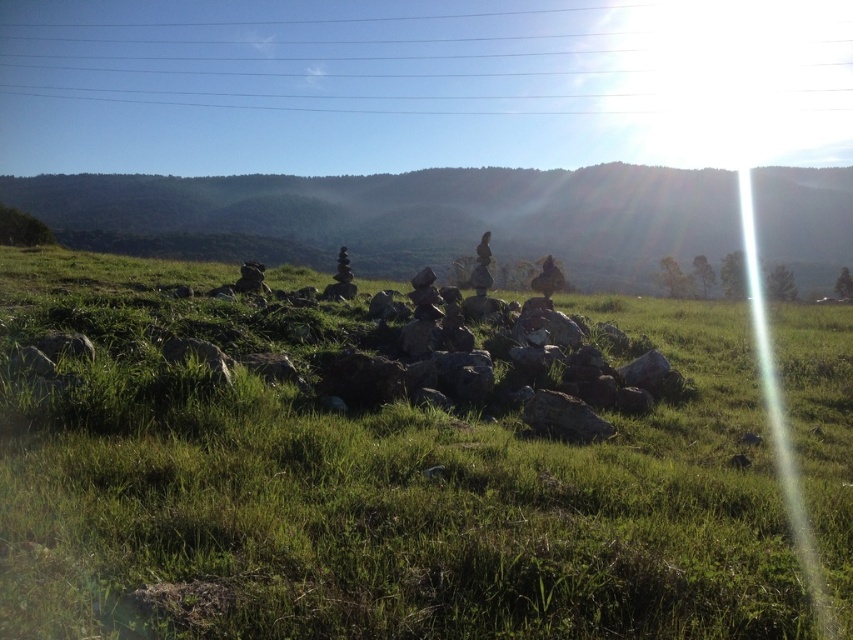
Question: Can you confirm if green grassy at center is wider than metallic wire at upper center?

Choices:
 (A) yes
 (B) no

Answer: (B)

Question: Can you confirm if green grassy at center is positioned above metallic wire at upper center?

Choices:
 (A) no
 (B) yes

Answer: (A)

Question: Which object is farther from the camera taking this photo?

Choices:
 (A) green grassy at center
 (B) metallic wire at upper center

Answer: (B)

Question: Which object appears farthest from the camera in this image?

Choices:
 (A) green grassy hillside at center
 (B) green grassy at center
 (C) metallic wire at upper center

Answer: (C)

Question: Does green grassy hillside at center come behind metallic wire at upper center?

Choices:
 (A) no
 (B) yes

Answer: (A)

Question: Which point is closer to the camera?

Choices:
 (A) (805, 209)
 (B) (155, 291)
 (C) (202, 80)

Answer: (B)